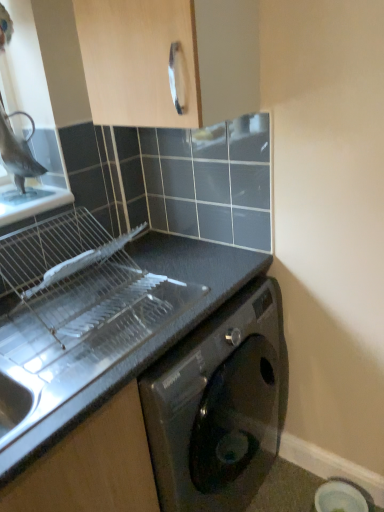
Question: From a real-world perspective, relative to matte black washing machine at lower right, is black matte countertop at lower left vertically above or below?

Choices:
 (A) above
 (B) below

Answer: (A)

Question: Considering the relative positions of black matte countertop at lower left and matte black washing machine at lower right in the image provided, is black matte countertop at lower left to the left or to the right of matte black washing machine at lower right?

Choices:
 (A) left
 (B) right

Answer: (A)

Question: Estimate the real-world distances between objects in this image. Which object is farther from the light wood cabinet handle at upper center?

Choices:
 (A) black matte countertop at lower left
 (B) matte black washing machine at lower right

Answer: (B)

Question: Estimate the real-world distances between objects in this image. Which object is farther from the black matte countertop at lower left?

Choices:
 (A) matte black washing machine at lower right
 (B) light wood cabinet handle at upper center

Answer: (A)